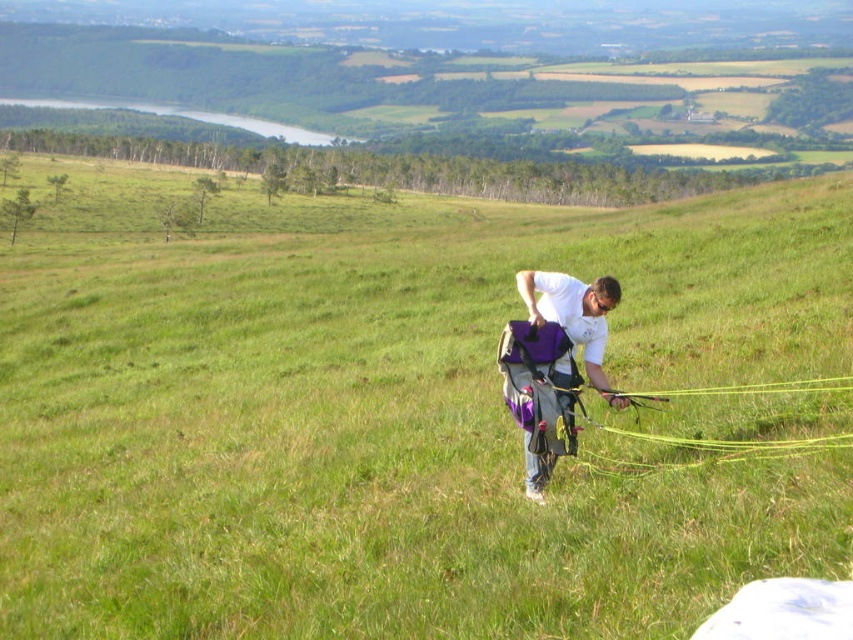
Question: Is yellow string at center wider than purple fabric backpack at center?

Choices:
 (A) yes
 (B) no

Answer: (A)

Question: Is yellow string at center thinner than purple fabric backpack at center?

Choices:
 (A) yes
 (B) no

Answer: (B)

Question: Is yellow string at center in front of purple fabric backpack at center?

Choices:
 (A) yes
 (B) no

Answer: (A)

Question: Among these objects, which one is farthest from the camera?

Choices:
 (A) yellow string at center
 (B) purple fabric backpack at center

Answer: (B)

Question: Among these objects, which one is nearest to the camera?

Choices:
 (A) purple fabric backpack at center
 (B) yellow string at center

Answer: (B)